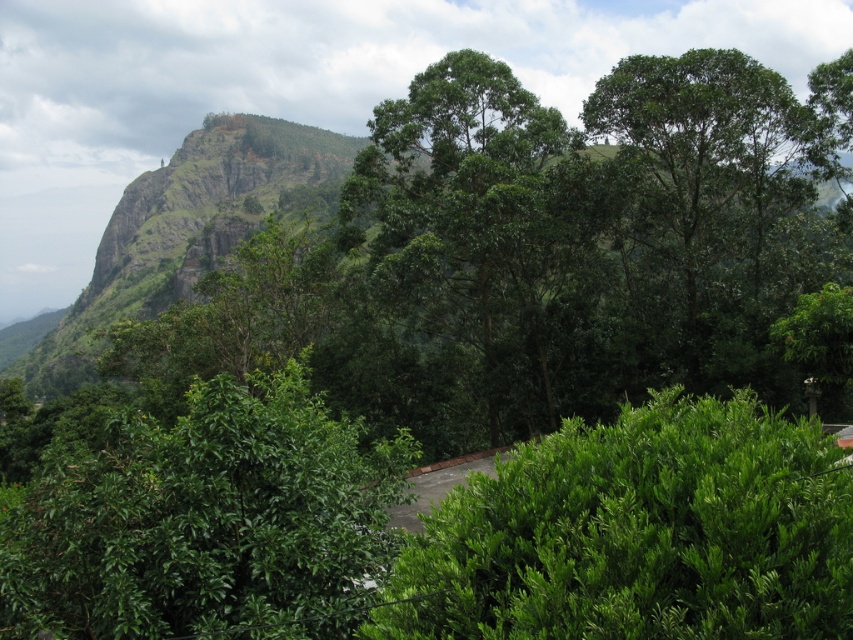
The height and width of the screenshot is (640, 853). In order to click on green leafy tree at center in this screenshot , I will do `click(474, 230)`.

Who is taller, green leafy tree at center or green leafy tree at upper right?

With more height is green leafy tree at center.

The image size is (853, 640). Describe the element at coordinates (474, 230) in the screenshot. I see `green leafy tree at center` at that location.

Locate an element on the screen. green leafy tree at center is located at coordinates (474, 230).